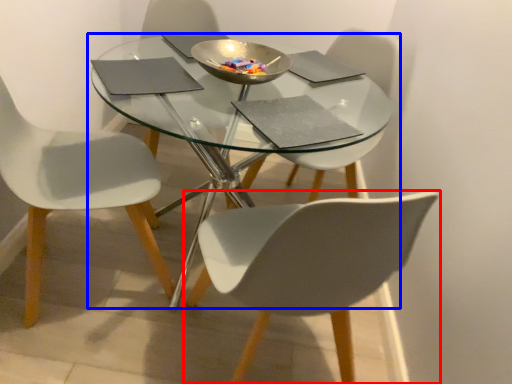
Question: Which of the following is the closest to the observer, chair (highlighted by a red box) or coffee table (highlighted by a blue box)?

Choices:
 (A) chair
 (B) coffee table

Answer: (A)